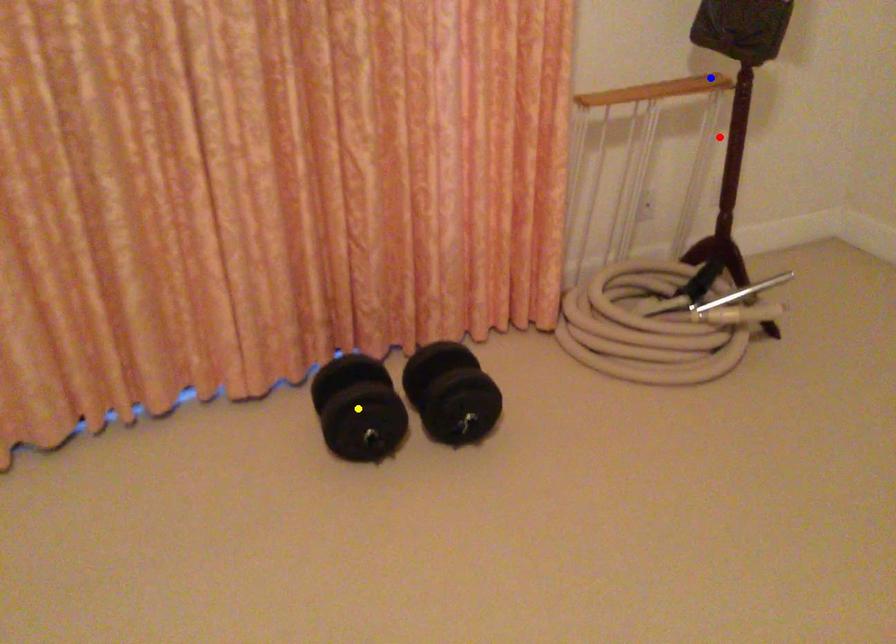
Order these from nearest to farthest:
blue point | red point | yellow point

yellow point → blue point → red point